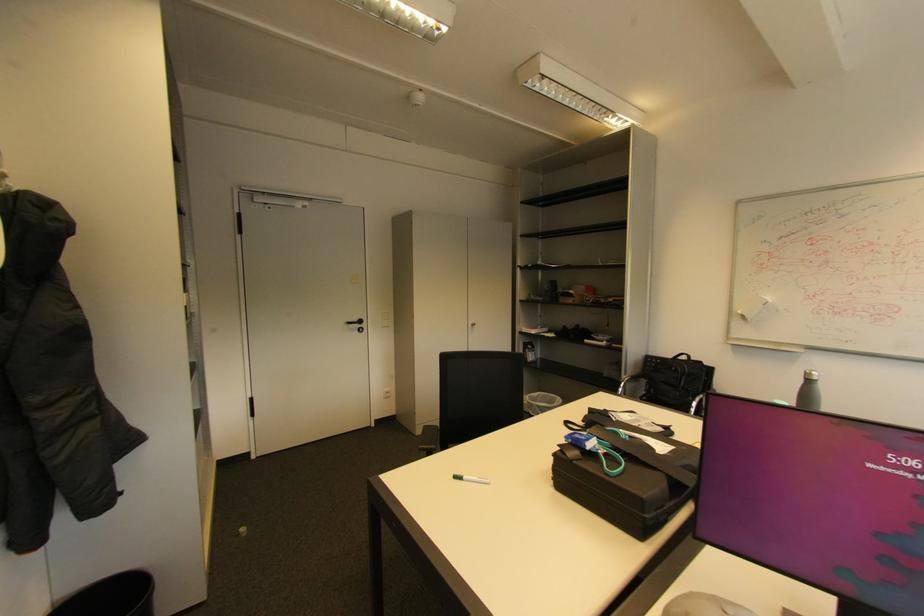
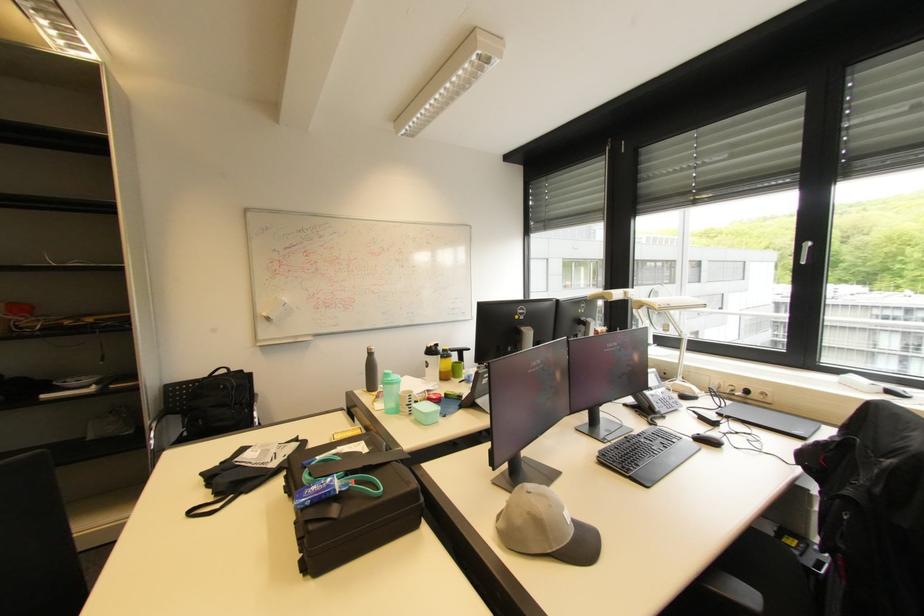
The point at [698,360] is marked in the first image. Where is the corresponding point in the second image?

(237, 371)